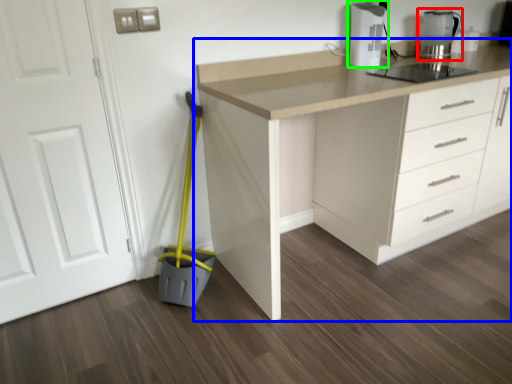
Question: Considering the real-world distances, which object is farthest from kitchen appliance (highlighted by a red box)? countertop (highlighted by a blue box) or home appliance (highlighted by a green box)?

Choices:
 (A) countertop
 (B) home appliance

Answer: (A)